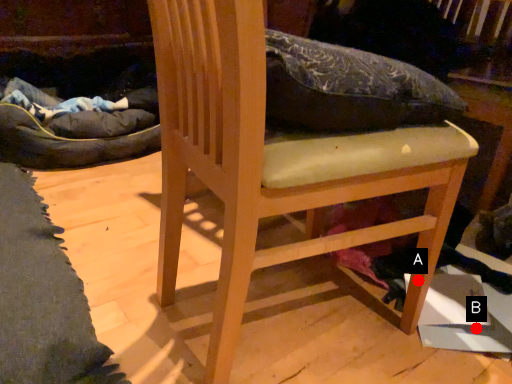
Question: Two points are circled on the image, labeled by A and B beside each circle. Which point is closer to the camera?

Choices:
 (A) A is closer
 (B) B is closer

Answer: (A)